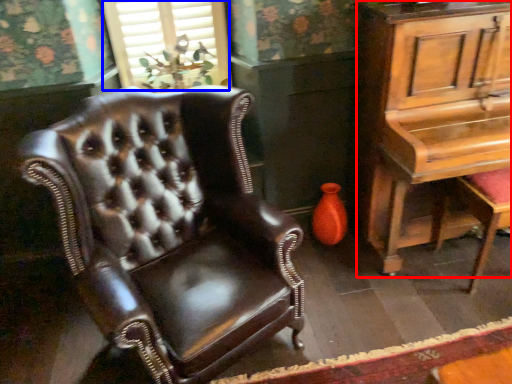
Question: Which object is further to the camera taking this photo, table (highlighted by a red box) or window (highlighted by a blue box)?

Choices:
 (A) table
 (B) window

Answer: (B)